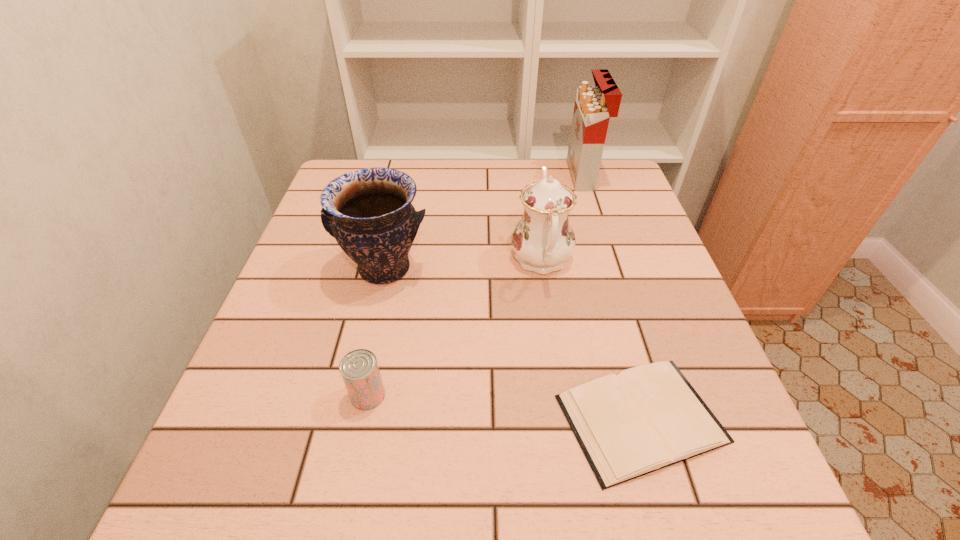
You are a GUI agent. You are given a task and a screenshot of the screen. Output one action in this format:
    pyautogui.click(x=<x>, y=<y>)
    Task: Click on the cigarette case
    The image size is (960, 540).
    Given the screenshot: What is the action you would take?
    pyautogui.click(x=594, y=105)

The image size is (960, 540). Find the location of `the tallest object`. the tallest object is located at coordinates (594, 105).

This screenshot has width=960, height=540. In order to click on chinaware in this screenshot , I will do `click(543, 239)`.

Find the location of a particular element. This screenshot has height=540, width=960. pottery is located at coordinates (369, 212).

The height and width of the screenshot is (540, 960). I want to click on the fourth tallest object, so click(x=359, y=369).

The height and width of the screenshot is (540, 960). What are the coordinates of `the shortest object` in the screenshot? It's located at (649, 417).

Locate an element on the screen. The image size is (960, 540). free location located 0.250m with the lid open on the farthest object is located at coordinates (484, 176).

Find the location of `vacant space positioned with the lid open on the farthest object`. vacant space positioned with the lid open on the farthest object is located at coordinates (508, 176).

The image size is (960, 540). In order to click on free space located 0.360m with the lid open on the farthest object in this screenshot , I will do `click(445, 176)`.

Locate an element on the screen. The height and width of the screenshot is (540, 960). free point located on the front of the chinaware is located at coordinates (562, 399).